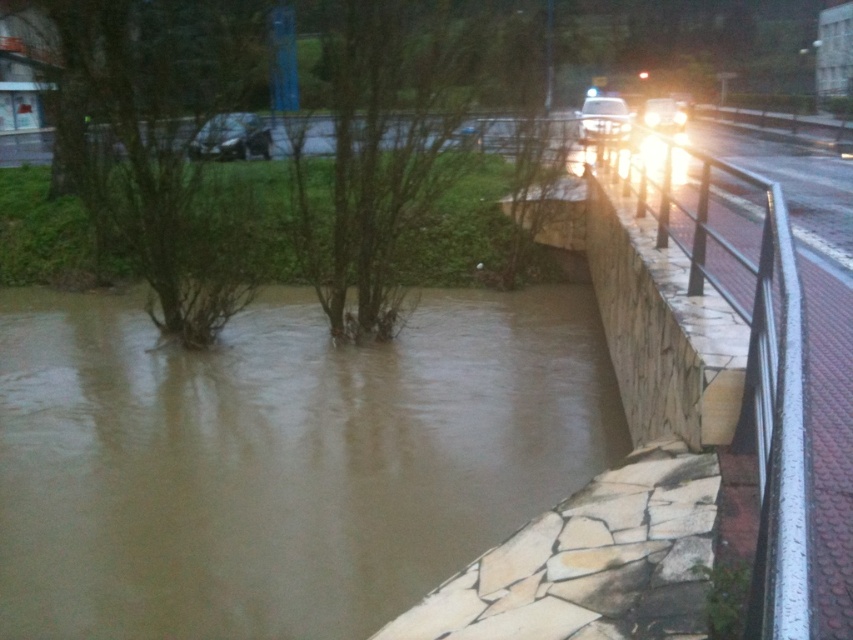
You are a delivery person trying to navigate through the flooded area. You see the brown muddy water at lower left and the metallic silver car at upper left. Which object is bigger in size?

The brown muddy water at lower left has a larger size compared to the metallic silver car at upper left, so the brown muddy water at lower left is bigger in size.

You are a rescue worker trying to reach a stranded person on the other side of the flooded area. You have a 5 meter long rope. The brown muddy water at lower left is between you and the stranded person. Can you safely use the rope to reach them?

The brown muddy water at lower left is 4.97 meters away from the viewer. Since the rope is 5 meters long, it is just long enough to safely reach the stranded person across the brown muddy water at lower left.

You are a pedestrian trying to cross the flooded area. You notice the brown muddy water at lower left and the metallic silver car at upper left. Which object is closer to the ground level?

The brown muddy water at lower left is shorter than the metallic silver car at upper left, so the brown muddy water at lower left is closer to the ground level.